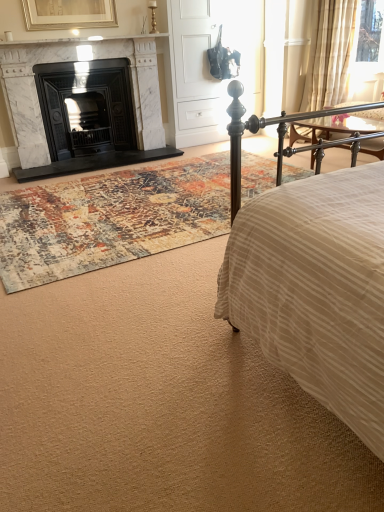
Question: From a real-world perspective, does white marble fireplace at left, which ranks as the 1th fireplace in right-to-left order, sit lower than white matte armoire at center?

Choices:
 (A) no
 (B) yes

Answer: (B)

Question: Can you confirm if white marble fireplace at left, which ranks as the 1th fireplace in right-to-left order, is taller than white matte armoire at center?

Choices:
 (A) yes
 (B) no

Answer: (B)

Question: Considering the relative positions of white marble fireplace at left, which ranks as the 1th fireplace in right-to-left order, and white matte armoire at center in the image provided, is white marble fireplace at left, which ranks as the 1th fireplace in right-to-left order, to the left of white matte armoire at center from the viewer's perspective?

Choices:
 (A) yes
 (B) no

Answer: (A)

Question: Is white marble fireplace at left, positioned as the second fireplace in left-to-right order, aimed at white matte armoire at center?

Choices:
 (A) yes
 (B) no

Answer: (B)

Question: Is white marble fireplace at left, positioned as the second fireplace in left-to-right order, next to white matte armoire at center?

Choices:
 (A) no
 (B) yes

Answer: (A)

Question: From a real-world perspective, is white matte armoire at center above or below multicolored rug at center?

Choices:
 (A) below
 (B) above

Answer: (B)

Question: Is white matte armoire at center inside the boundaries of multicolored rug at center, or outside?

Choices:
 (A) inside
 (B) outside

Answer: (B)

Question: From the image's perspective, is white matte armoire at center located above or below multicolored rug at center?

Choices:
 (A) below
 (B) above

Answer: (B)

Question: In the image, is white matte armoire at center on the left side or the right side of multicolored rug at center?

Choices:
 (A) left
 (B) right

Answer: (B)

Question: From their relative heights in the image, would you say black marble fireplace at left, placed as the 1th fireplace when sorted from left to right, is taller or shorter than white marble fireplace at left, which ranks as the 1th fireplace in right-to-left order?

Choices:
 (A) short
 (B) tall

Answer: (A)

Question: In the image, is black marble fireplace at left, the 2th fireplace when ordered from right to left, on the left side or the right side of white marble fireplace at left, positioned as the second fireplace in left-to-right order?

Choices:
 (A) left
 (B) right

Answer: (A)

Question: Based on their sizes in the image, would you say black marble fireplace at left, placed as the 1th fireplace when sorted from left to right, is bigger or smaller than white marble fireplace at left, which ranks as the 1th fireplace in right-to-left order?

Choices:
 (A) small
 (B) big

Answer: (A)

Question: From a real-world perspective, is black marble fireplace at left, placed as the 1th fireplace when sorted from left to right, positioned above or below white marble fireplace at left, positioned as the second fireplace in left-to-right order?

Choices:
 (A) below
 (B) above

Answer: (A)

Question: Considering the positions of white matte armoire at center and sheer beige fabric at upper right in the image, is white matte armoire at center bigger or smaller than sheer beige fabric at upper right?

Choices:
 (A) big
 (B) small

Answer: (A)

Question: Would you say white matte armoire at center is to the left or to the right of sheer beige fabric at upper right in the picture?

Choices:
 (A) left
 (B) right

Answer: (A)